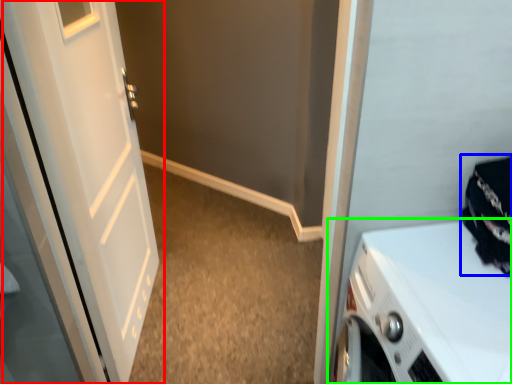
Question: Estimate the real-world distances between objects in this image. Which object is farther from door (highlighted by a red box), clothing (highlighted by a blue box) or home appliance (highlighted by a green box)?

Choices:
 (A) clothing
 (B) home appliance

Answer: (A)